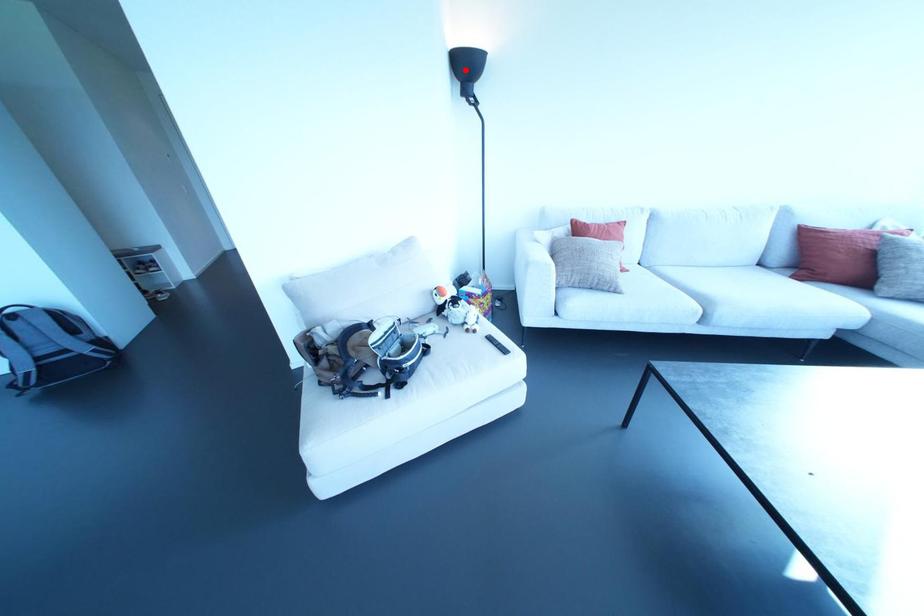
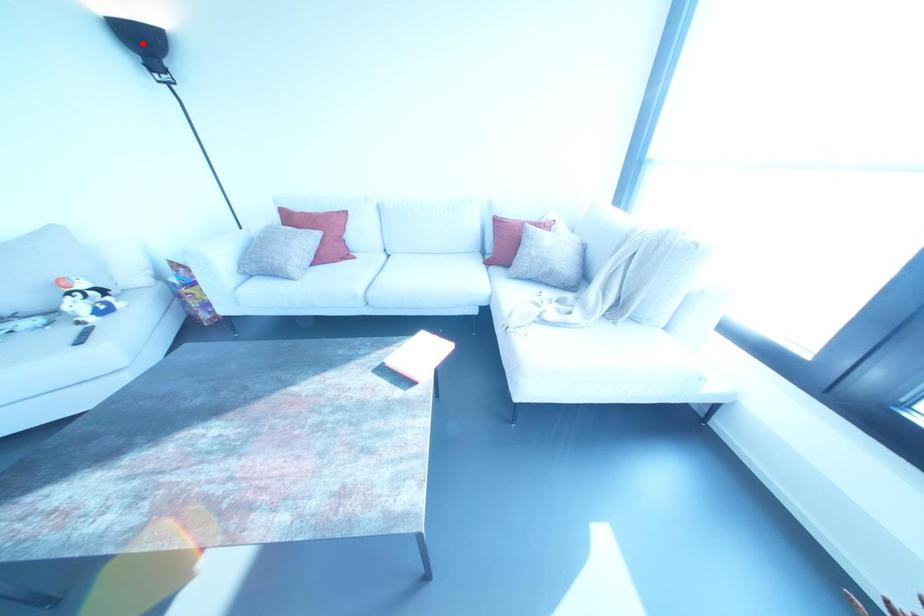
I am providing you with two images of the same scene from different viewpoints. A red point is marked on the first image and another point is marked on the second image. Do the highlighted points in image1 and image2 indicate the same real-world spot?

Yes